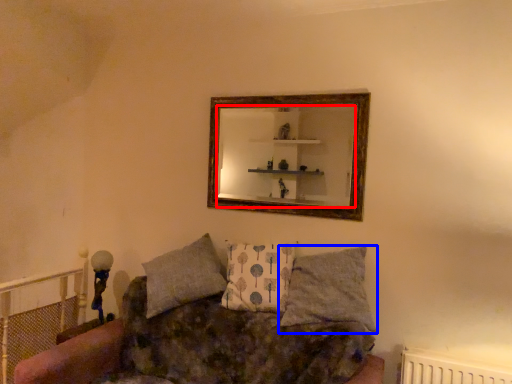
Question: Which point is further to the camera, mirror (highlighted by a red box) or pillow (highlighted by a blue box)?

Choices:
 (A) mirror
 (B) pillow

Answer: (A)